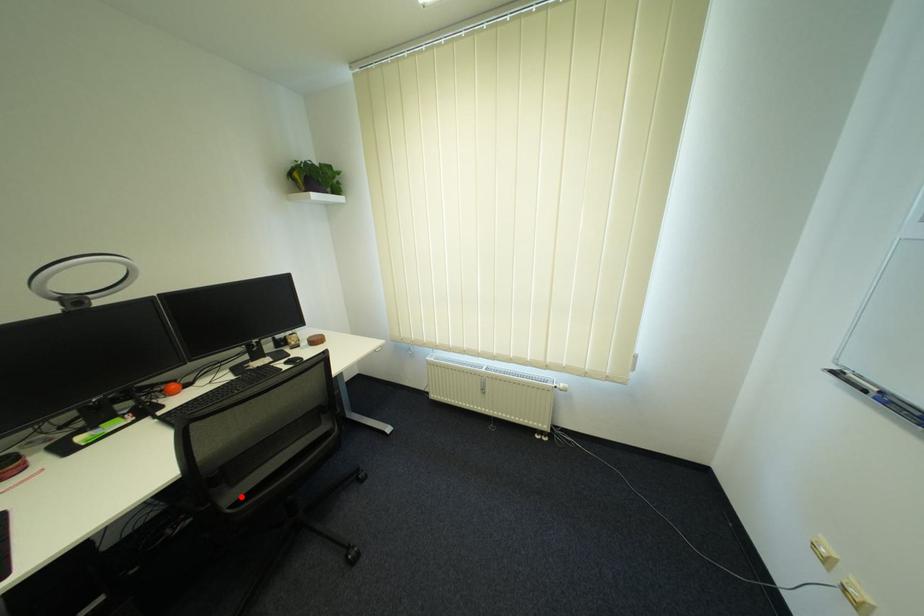
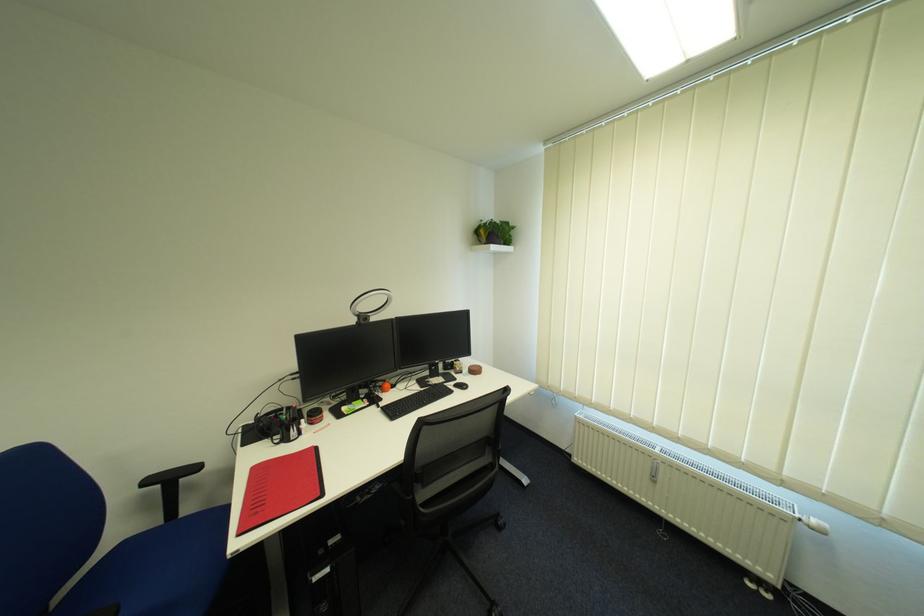
Question: I am providing you with two images of the same scene from different viewpoints. Image1 has a red point marked. In image2, the corresponding 3D location appears at what relative position? Reply with the corresponding letter.

Choices:
 (A) Closer
 (B) Farther

Answer: (B)